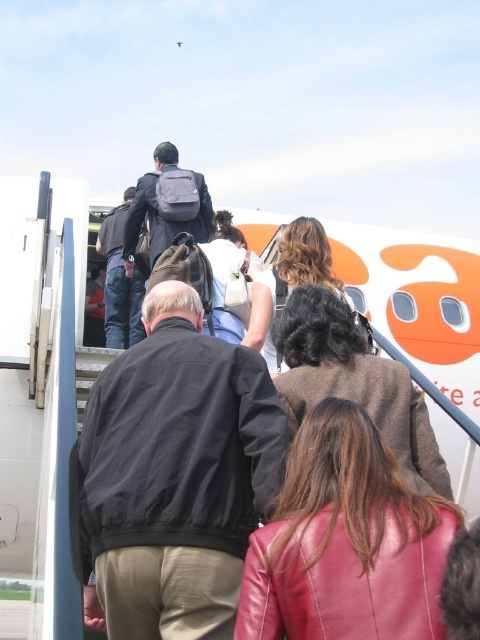
You are a flight attendant standing at the base of the boarding staircase. You need to retrieve an item from either the leather jacket at center or the matte gray backpack at center. If the staircase is 15 meters long, can you reach both items without climbing the staircase?

The distance between the leather jacket at center and the matte gray backpack at center is 16.68 meters. Since the staircase is only 15 meters long, you cannot reach both items without climbing the staircase because they are further away than the staircase length.

You are a passenger trying to board the airplane and notice two items at the center of your view. Which item is closer to you, the brown leather jacket at center or the matte gray backpack at center?

The brown leather jacket at center is closer to you because it is in front of the matte gray backpack at center.